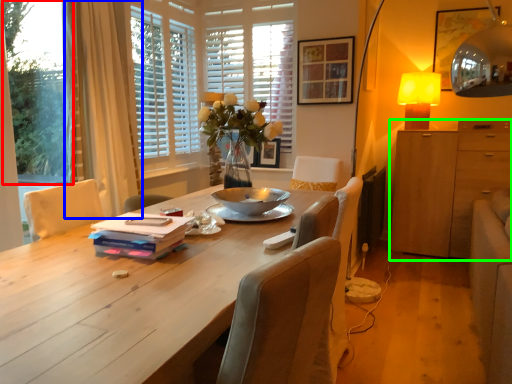
Question: Which object is positioned closest to window screen (highlighted by a red box)? Select from curtain (highlighted by a blue box) and cabinetry (highlighted by a green box).

Choices:
 (A) curtain
 (B) cabinetry

Answer: (A)